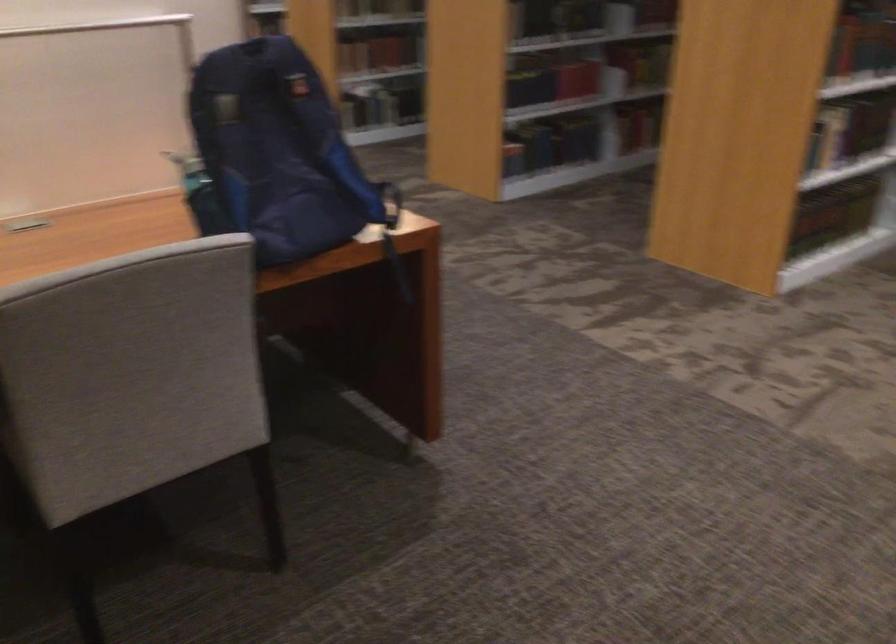
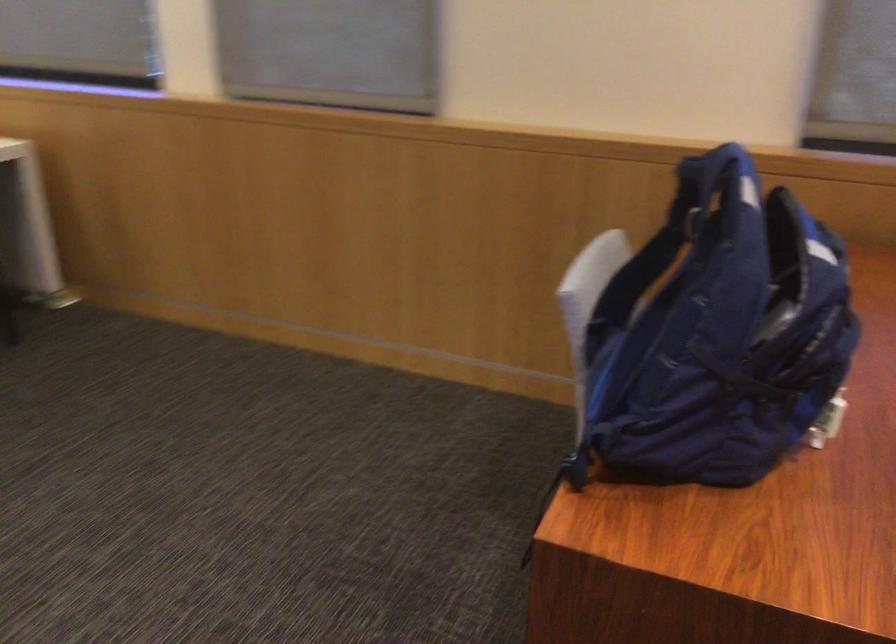
Where in the second image is the point corresponding to point (216, 193) from the first image?

(645, 285)